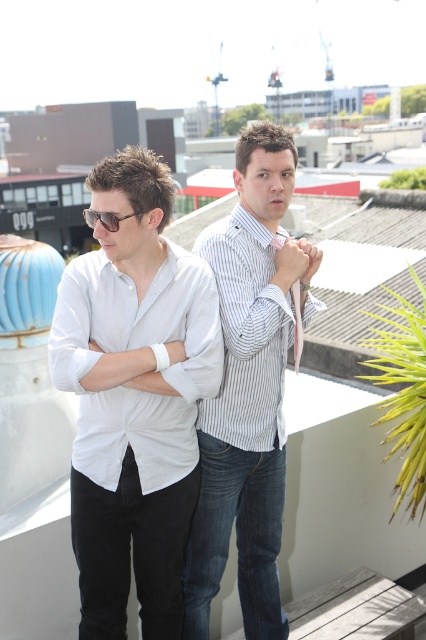
You are a photographer positioned at the front of the scene. You need to capture a clear shot of both the white striped shirt at center and the matte black sunglasses at left. Which object should you adjust your focus on first to ensure both are in frame?

The matte black sunglasses at left is behind the white striped shirt at center. To ensure both are in frame, focus on the white striped shirt at center first since it is closer to you, then adjust the focus to include the matte black sunglasses at left in the background.

You are a photographer positioned at the back of the rooftop terrace. You want to take a photo of both the white cotton shirt at center and the white cotton dress shirt at left. Which one is closer to you?

The white cotton dress shirt at left is closer to you because the white cotton shirt at center is located below it, meaning the dress shirt is positioned higher up and thus nearer in the frame.

You are organizing a charity event and need to decide whether to place a decorative box on the table between the white cotton dress shirt at left and the silky white tie at center. The box requires 30 cm of space. Can you determine if there is enough space between them?

The white cotton dress shirt at left is larger in size than the silky white tie at center, but the exact distance between them isn generated in the Objects Description. Therefore, it is impossible to determine if there is enough space for the 30 cm box.